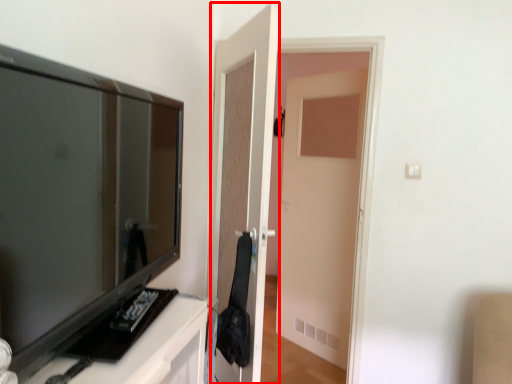
Question: From the image's perspective, considering the relative positions of door (annotated by the red box) and television in the image provided, where is door (annotated by the red box) located with respect to the staircase?

Choices:
 (A) below
 (B) above

Answer: (A)